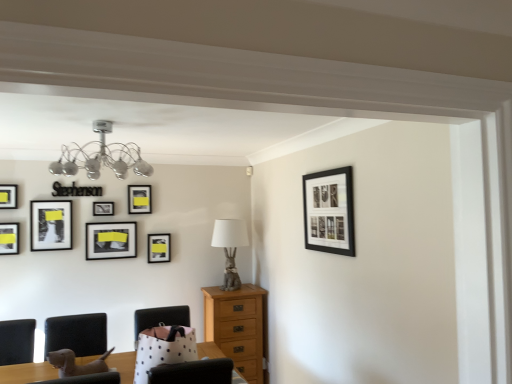
Question: Can you confirm if chrome metallic chandelier at upper left is positioned to the right of white polka dot fabric armchair at center, which is the 1th armchair in right-to-left order?

Choices:
 (A) yes
 (B) no

Answer: (B)

Question: From the image's perspective, does chrome metallic chandelier at upper left appear lower than white polka dot fabric armchair at center, acting as the 2th armchair starting from the left?

Choices:
 (A) yes
 (B) no

Answer: (B)

Question: Does chrome metallic chandelier at upper left have a greater width compared to white polka dot fabric armchair at center, acting as the 2th armchair starting from the left?

Choices:
 (A) yes
 (B) no

Answer: (A)

Question: Is chrome metallic chandelier at upper left shorter than white polka dot fabric armchair at center, which is the 1th armchair in right-to-left order?

Choices:
 (A) no
 (B) yes

Answer: (B)

Question: Would you say white polka dot fabric armchair at center, which is the 1th armchair in right-to-left order, is part of chrome metallic chandelier at upper left's contents?

Choices:
 (A) yes
 (B) no

Answer: (B)

Question: Considering the relative positions of matte black picture frame at left, marked as the 6th picture frame in a right-to-left arrangement, and light brown wooden chest of drawers at center in the image provided, is matte black picture frame at left, marked as the 6th picture frame in a right-to-left arrangement, to the left or to the right of light brown wooden chest of drawers at center?

Choices:
 (A) left
 (B) right

Answer: (A)

Question: Considering the positions of point (56, 215) and point (217, 299), is point (56, 215) closer or farther from the camera than point (217, 299)?

Choices:
 (A) farther
 (B) closer

Answer: (B)

Question: Considering the positions of matte black picture frame at left, marked as the 6th picture frame in a right-to-left arrangement, and light brown wooden chest of drawers at center in the image, is matte black picture frame at left, marked as the 6th picture frame in a right-to-left arrangement, bigger or smaller than light brown wooden chest of drawers at center?

Choices:
 (A) small
 (B) big

Answer: (A)

Question: Is matte black picture frame at left, the 4th picture frame in the front-to-back sequence, wider or thinner than light brown wooden chest of drawers at center?

Choices:
 (A) thin
 (B) wide

Answer: (A)

Question: From a real-world perspective, is matte black picture frame at left, marked as the 6th picture frame in a right-to-left arrangement, positioned above or below gray fabric lamp at center?

Choices:
 (A) below
 (B) above

Answer: (B)

Question: In terms of width, does matte black picture frame at left, which ranks as the third picture frame in left-to-right order, look wider or thinner when compared to gray fabric lamp at center?

Choices:
 (A) wide
 (B) thin

Answer: (B)

Question: Considering the positions of matte black picture frame at left, the 4th picture frame in the front-to-back sequence, and gray fabric lamp at center in the image, is matte black picture frame at left, the 4th picture frame in the front-to-back sequence, bigger or smaller than gray fabric lamp at center?

Choices:
 (A) small
 (B) big

Answer: (A)

Question: Does point (32, 241) appear closer or farther from the camera than point (239, 228)?

Choices:
 (A) farther
 (B) closer

Answer: (B)

Question: In the image, is matte black picture frame at upper left, which is counted as the third picture frame, starting from the back, on the left side or the right side of white polka dot fabric armchair at center, which is the 1th armchair in right-to-left order?

Choices:
 (A) left
 (B) right

Answer: (A)

Question: From their relative heights in the image, would you say matte black picture frame at upper left, arranged as the fourth picture frame when viewed from the left, is taller or shorter than white polka dot fabric armchair at center, which is the 1th armchair in right-to-left order?

Choices:
 (A) tall
 (B) short

Answer: (B)